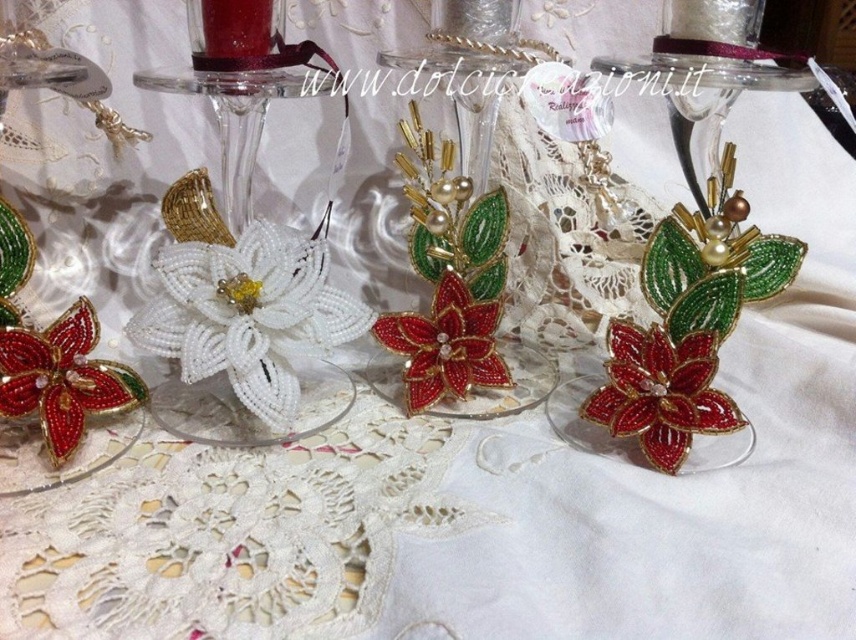
Which is more to the right, shiny red beaded flower at center right or matte red beaded flower at lower left?

Positioned to the right is shiny red beaded flower at center right.

Which is behind, point (605, 388) or point (113, 376)?

The point (605, 388) is behind.

Locate an element on the screen. The height and width of the screenshot is (640, 856). shiny red beaded flower at center right is located at coordinates (661, 392).

Does point (6, 372) lie behind point (440, 285)?

No, it is in front of (440, 285).

Who is shorter, matte red beaded flower at lower left or shiny red beaded flower at center?

shiny red beaded flower at center is shorter.

Does point (9, 369) come closer to viewer compared to point (467, 372)?

Yes, it is in front of point (467, 372).

The height and width of the screenshot is (640, 856). What are the coordinates of `matte red beaded flower at lower left` in the screenshot? It's located at (62, 378).

Does shiny red beaded flower at center right appear on the right side of shiny red beaded flower at center?

Indeed, shiny red beaded flower at center right is positioned on the right side of shiny red beaded flower at center.

At what (x,y) coordinates should I click in order to perform the action: click on shiny red beaded flower at center right. Please return your answer as a coordinate pair (x, y). The image size is (856, 640). Looking at the image, I should click on (661, 392).

Who is more forward, (652, 433) or (467, 337)?

Point (652, 433) is more forward.

Find the location of a particular element. The image size is (856, 640). shiny red beaded flower at center right is located at coordinates (661, 392).